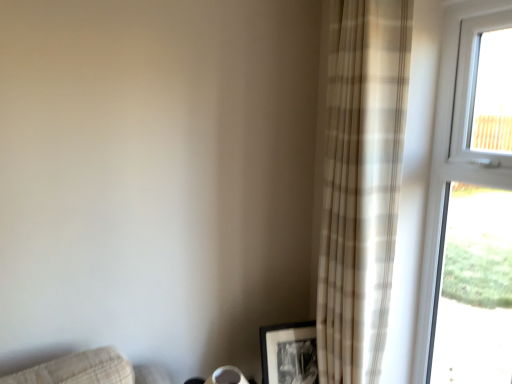
Question: Is black matte picture frame at lower right oriented towards beige plaid curtain at right?

Choices:
 (A) no
 (B) yes

Answer: (B)

Question: From the image's perspective, is black matte picture frame at lower right over beige plaid curtain at right?

Choices:
 (A) no
 (B) yes

Answer: (A)

Question: Is black matte picture frame at lower right at the left side of beige plaid curtain at right?

Choices:
 (A) yes
 (B) no

Answer: (A)

Question: Is black matte picture frame at lower right thinner than beige plaid curtain at right?

Choices:
 (A) yes
 (B) no

Answer: (A)

Question: Considering the relative sizes of black matte picture frame at lower right and beige plaid curtain at right in the image provided, is black matte picture frame at lower right bigger than beige plaid curtain at right?

Choices:
 (A) no
 (B) yes

Answer: (A)

Question: Is black matte picture frame at lower right placed right next to beige plaid curtain at right?

Choices:
 (A) no
 (B) yes

Answer: (A)

Question: Considering the relative positions of white plastic window at upper right and beige plaid curtain at right in the image provided, is white plastic window at upper right to the left of beige plaid curtain at right from the viewer's perspective?

Choices:
 (A) no
 (B) yes

Answer: (A)

Question: Is the surface of white plastic window at upper right in direct contact with beige plaid curtain at right?

Choices:
 (A) no
 (B) yes

Answer: (A)

Question: Does white plastic window at upper right have a lesser height compared to beige plaid curtain at right?

Choices:
 (A) yes
 (B) no

Answer: (A)

Question: Is white plastic window at upper right wider than beige plaid curtain at right?

Choices:
 (A) no
 (B) yes

Answer: (A)

Question: Would you say white plastic window at upper right is a long distance from beige plaid curtain at right?

Choices:
 (A) yes
 (B) no

Answer: (B)

Question: Can beige plaid curtain at right be found inside white plastic window at upper right?

Choices:
 (A) yes
 (B) no

Answer: (B)

Question: Considering the relative sizes of beige plaid curtain at right and white plastic window at upper right in the image provided, is beige plaid curtain at right thinner than white plastic window at upper right?

Choices:
 (A) yes
 (B) no

Answer: (B)